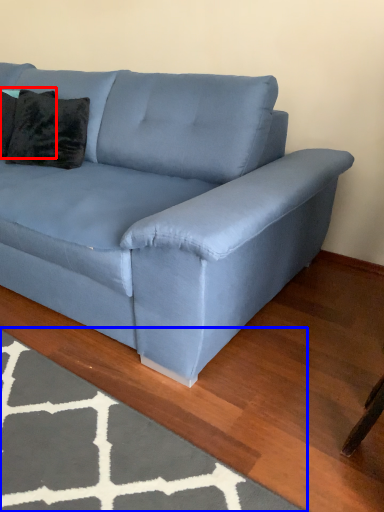
Question: Which of the following is the farthest to the observer, pillow (highlighted by a red box) or mat (highlighted by a blue box)?

Choices:
 (A) pillow
 (B) mat

Answer: (A)